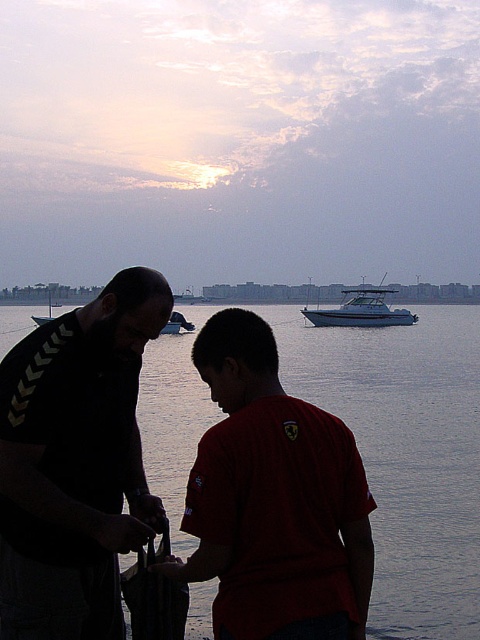
Who is positioned more to the left, matte red shirt at center or white glossy boat at upper center?

matte red shirt at center is more to the left.

Does matte red shirt at center appear under white glossy boat at upper center?

Yes, matte red shirt at center is below white glossy boat at upper center.

What do you see at coordinates (274, 499) in the screenshot? I see `matte red shirt at center` at bounding box center [274, 499].

Image resolution: width=480 pixels, height=640 pixels. What are the coordinates of `matte red shirt at center` in the screenshot? It's located at (274, 499).

Is black matte shirt at center positioned behind white glossy boat at upper center?

No, it is not.

Who is more forward, (127, 540) or (312, 310)?

Positioned in front is point (127, 540).

You are a GUI agent. You are given a task and a screenshot of the screen. Output one action in this format:
    pyautogui.click(x=<x>, y=<y>)
    Task: Click on the black matte shirt at center
    
    Given the screenshot: What is the action you would take?
    pyautogui.click(x=75, y=461)

Does black matte shirt at center have a lesser width compared to metallic silver boat at center?

Yes, black matte shirt at center is thinner than metallic silver boat at center.

Locate an element on the screen. The width and height of the screenshot is (480, 640). black matte shirt at center is located at coordinates (75, 461).